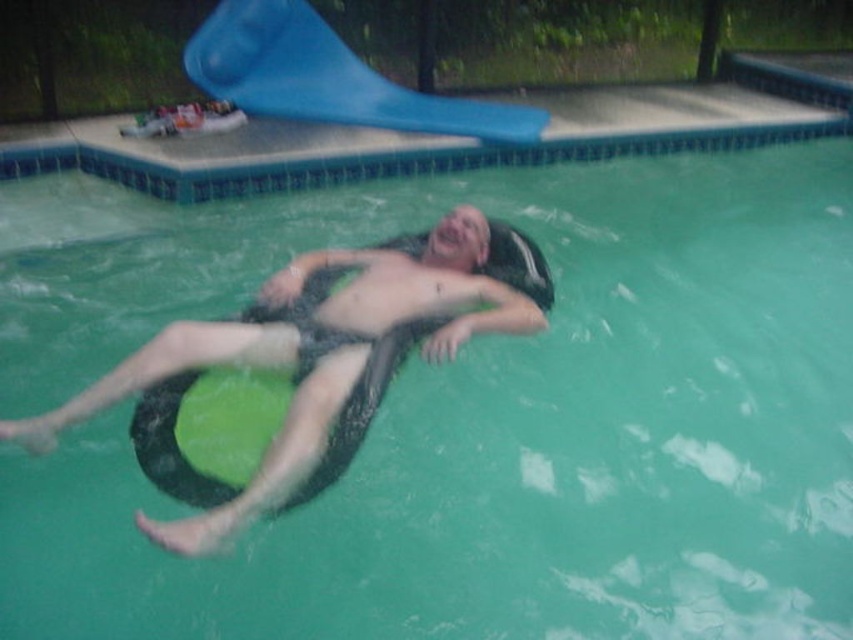
Can you confirm if black rubber tube at center is shorter than blue rubber slide at upper center?

No.

In the scene shown: Is black rubber tube at center to the left of blue rubber slide at upper center from the viewer's perspective?

No, black rubber tube at center is not to the left of blue rubber slide at upper center.

Identify the location of black rubber tube at center. (323, 356).

Locate an element on the screen. Image resolution: width=853 pixels, height=640 pixels. black rubber tube at center is located at coordinates (323, 356).